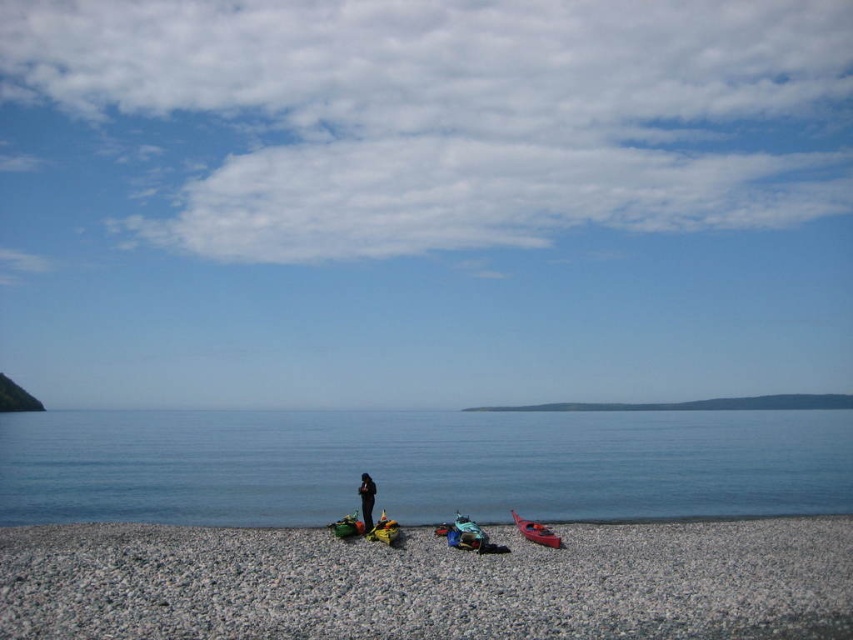
In the scene shown: You are standing on the pebble beach and see a point marked at coordinates (535, 531). Which object from the scene does this point belong to?

The point at coordinates (535, 531) is located on the matte red kayak at lower right.

You are standing on the pebble beach and see two points marked in the scene. Which point, point (532, 532) or point (363, 497), is closer to you?

Point (532, 532) is closer to the camera than point (363, 497), so it is closer to you.